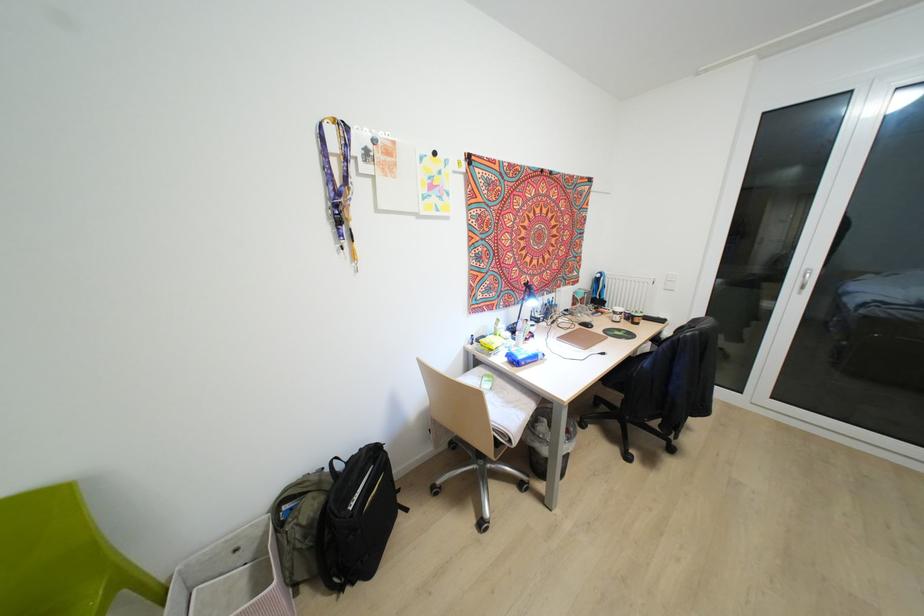
Where would you sit the green chair sitting surface? Please return your answer as a coordinate pair (x, y).

(54, 586)